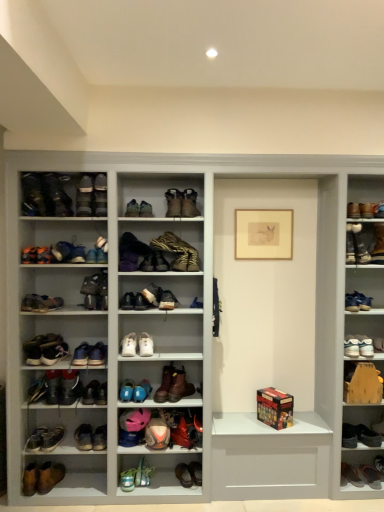
Question: Are brown suede boot at center, the 3th shoe positioned from the top, and white leather sneaker at center, positioned as the 6th shoe in bottom-to-top order, beside each other?

Choices:
 (A) no
 (B) yes

Answer: (A)

Question: Can you confirm if brown suede boot at center, the 11th shoe positioned from the bottom, is wider than white leather sneaker at center, positioned as the 6th shoe in bottom-to-top order?

Choices:
 (A) no
 (B) yes

Answer: (B)

Question: Can you confirm if brown suede boot at center, the 3th shoe positioned from the top, is positioned to the right of white leather sneaker at center, positioned as the 6th shoe in bottom-to-top order?

Choices:
 (A) yes
 (B) no

Answer: (A)

Question: Is brown suede boot at center, the 11th shoe positioned from the bottom, outside white leather sneaker at center, positioned as the 6th shoe in bottom-to-top order?

Choices:
 (A) yes
 (B) no

Answer: (A)

Question: From the image's perspective, is brown suede boot at center, the 11th shoe positioned from the bottom, on white leather sneaker at center, the eighth shoe from the top?

Choices:
 (A) yes
 (B) no

Answer: (A)

Question: Is the position of brown suede boot at center, the 11th shoe positioned from the bottom, more distant than that of white leather sneaker at center, the eighth shoe from the top?

Choices:
 (A) yes
 (B) no

Answer: (A)

Question: From a real-world perspective, is brown suede boot at center, which is the sixteenth footwear from right to left, on blue suede shoes at lower center, the 24th footwear positioned from the right?

Choices:
 (A) yes
 (B) no

Answer: (A)

Question: Is brown suede boot at center, which is the sixteenth footwear from right to left, turned away from blue suede shoes at lower center, the 9th footwear in the left-to-right sequence?

Choices:
 (A) yes
 (B) no

Answer: (B)

Question: Does brown suede boot at center, which is the 17th footwear from left to right, appear on the left side of blue suede shoes at lower center, the 9th footwear in the left-to-right sequence?

Choices:
 (A) no
 (B) yes

Answer: (A)

Question: Is brown suede boot at center, which is the 17th footwear from left to right, smaller than blue suede shoes at lower center, the 9th footwear in the left-to-right sequence?

Choices:
 (A) no
 (B) yes

Answer: (A)

Question: Considering the relative sizes of brown suede boot at center, which is the 17th footwear from left to right, and blue suede shoes at lower center, the 9th footwear in the left-to-right sequence, in the image provided, is brown suede boot at center, which is the 17th footwear from left to right, bigger than blue suede shoes at lower center, the 9th footwear in the left-to-right sequence,?

Choices:
 (A) yes
 (B) no

Answer: (A)

Question: Is brown suede boot at lower right, marked as the 31th footwear in a left-to-right arrangement, taller than leather snakeskin boot at center, the fifteenth footwear from the right?

Choices:
 (A) no
 (B) yes

Answer: (A)